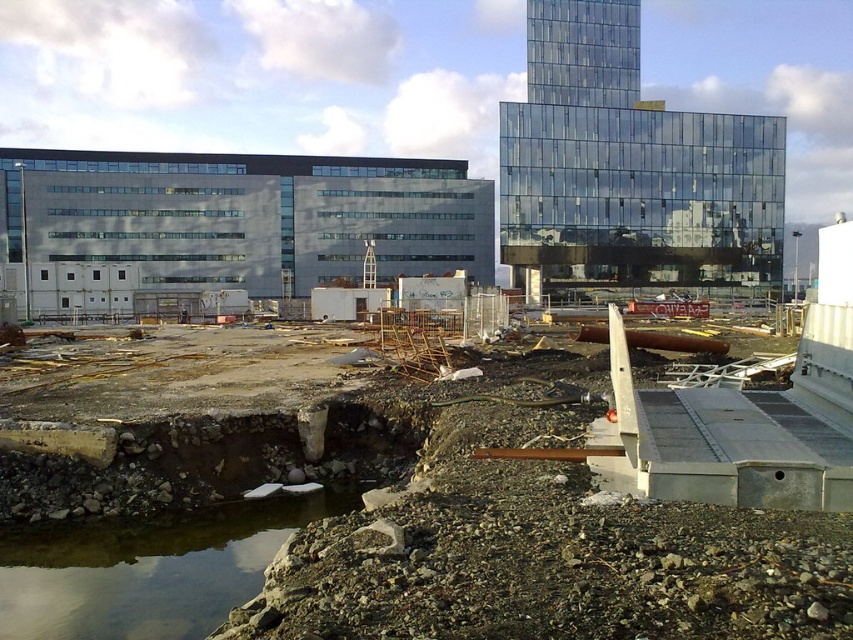
You are a construction worker who needs to move a heavy equipment from the gray concrete building at left to the transparent glass building at upper center. Which direction should you move the equipment to reach the destination?

The gray concrete building at left is positioned on the left side of the transparent glass building at upper center, so you should move the equipment to the right to reach the transparent glass building at upper center.

You are a surveyor at an urban construction site. You need to place a new equipment container at the point with coordinates 0.8, 0.65. Will this container be placed near the rustic concrete foundation at center?

The rustic concrete foundation at center is located at point [573,522]. The new equipment container at [554,512] is very close to this point, so yes, it will be placed near the rustic concrete foundation at center.

From the picture: You are a construction worker who needs to place a heavy equipment on the ground. You see the rustic concrete foundation at center and the gray concrete building at left. Which location would be more stable for placing the equipment?

The rustic concrete foundation at center is positioned under the gray concrete building at left, so placing the equipment on the rustic concrete foundation at center would be more stable as it is part of the building structure and likely more solid.